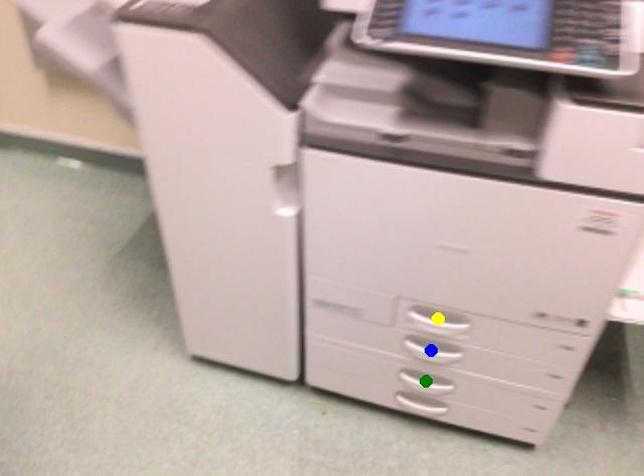
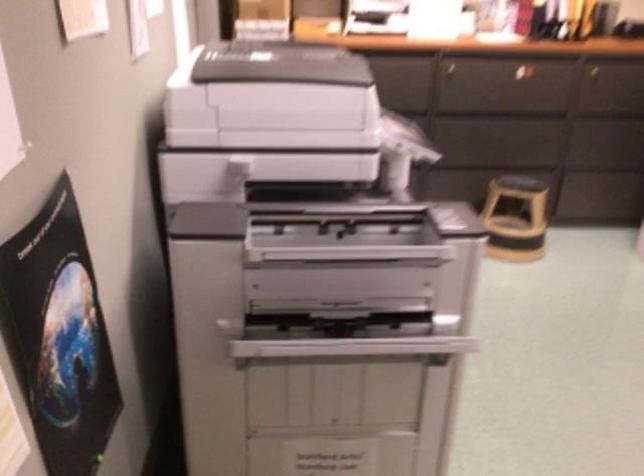
I am providing you with two images of the same scene from different viewpoints. Three points are marked in image1. Which point corresponds to a part or object that is occluded in image2?In image1, three points are marked. Which of them correspond to a part or object that is occluded in image2?Among the three points shown in image1, which one corresponds to a part or object that is no longer visible due to occlusion in image2?

green point, blue point, yellow point cannot be seen in image2.